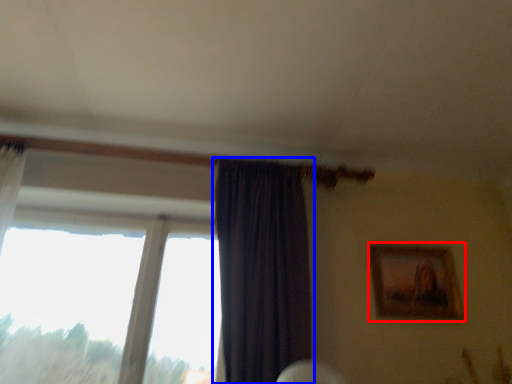
Question: Which point is further to the camera, picture frame (highlighted by a red box) or curtain (highlighted by a blue box)?

Choices:
 (A) picture frame
 (B) curtain

Answer: (A)